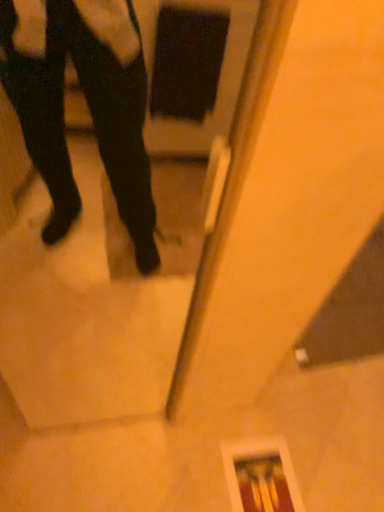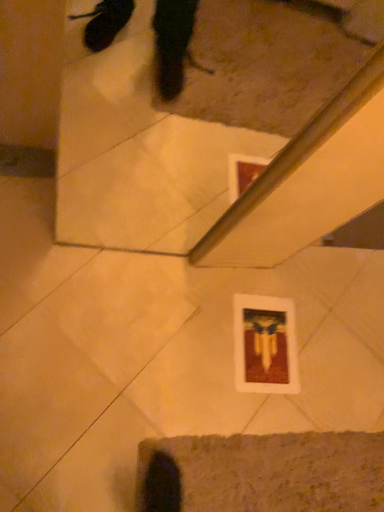
Question: Which way did the camera rotate in the video?

Choices:
 (A) rotated upward
 (B) rotated downward

Answer: (B)